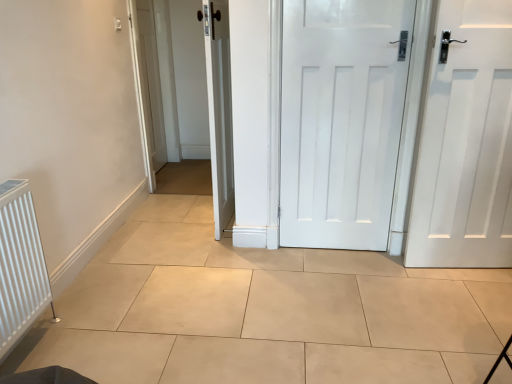
Where is `vacant space situated on the left part of white matte door at right, placed as the third door when sorted from left to right`? The image size is (512, 384). vacant space situated on the left part of white matte door at right, placed as the third door when sorted from left to right is located at coordinates (402, 288).